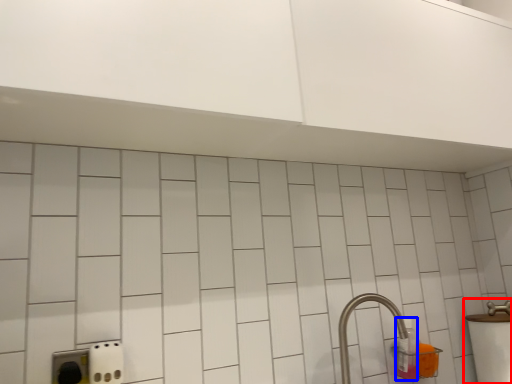
Question: Which object is closer to the camera taking this photo, sink (highlighted by a red box) or bottle (highlighted by a blue box)?

Choices:
 (A) sink
 (B) bottle

Answer: (A)